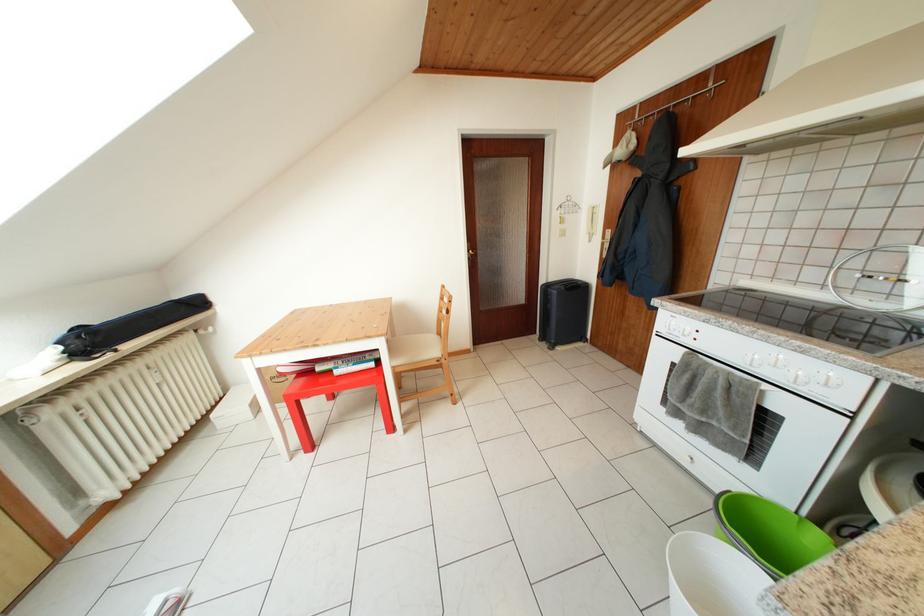
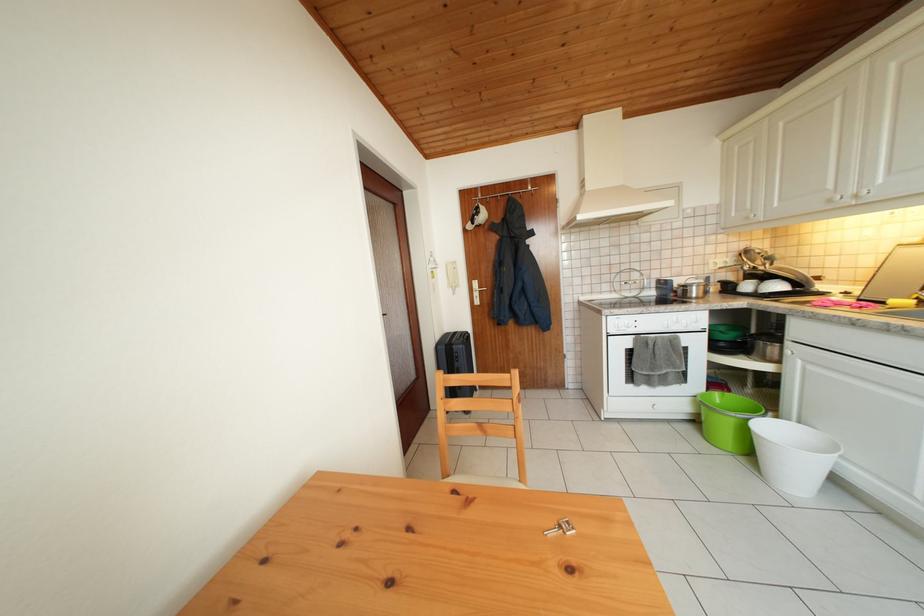
In the second image, find the point that corresponds to (617,238) in the first image.

(483, 288)